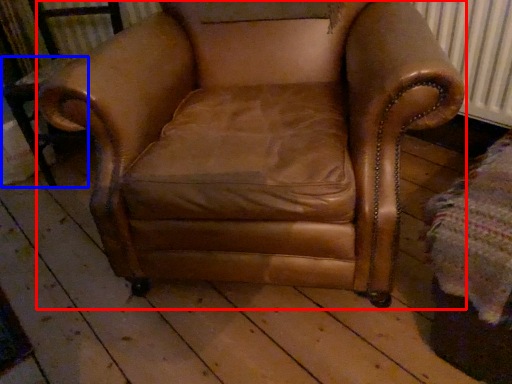
Question: Which point is further to the camera, chair (highlighted by a red box) or side table (highlighted by a blue box)?

Choices:
 (A) chair
 (B) side table

Answer: (B)